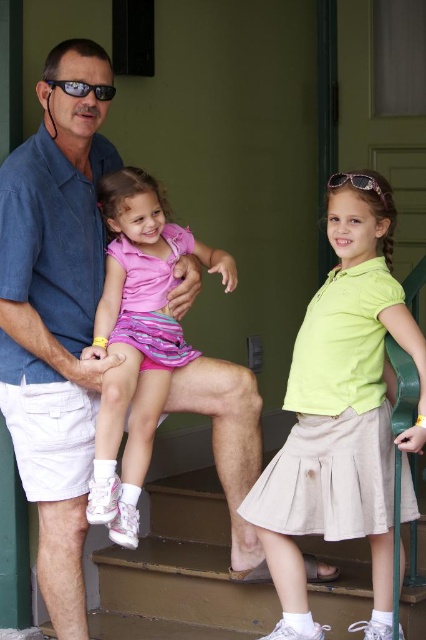
Looking at this image, can you confirm if matte blue shirt at center is smaller than lime green polo shirt at center?

Actually, matte blue shirt at center might be larger than lime green polo shirt at center.

Is point (235, 525) in front of point (275, 474)?

No, (235, 525) is behind (275, 474).

Find the location of `matte blue shirt at center`. matte blue shirt at center is located at coordinates (55, 316).

Where is `matte blue shirt at center`? Image resolution: width=426 pixels, height=640 pixels. matte blue shirt at center is located at coordinates (55, 316).

Locate an element on the screen. lime green polo shirt at center is located at coordinates (340, 412).

Which is behind, point (328, 294) or point (141, 252)?

Point (141, 252)

Between point (313, 433) and point (127, 339), which one is positioned in front?

Positioned in front is point (313, 433).

Who is more distant from viewer, (275, 467) or (131, 525)?

The point (275, 467) is behind.

The image size is (426, 640). In order to click on lime green polo shirt at center in this screenshot , I will do `click(340, 412)`.